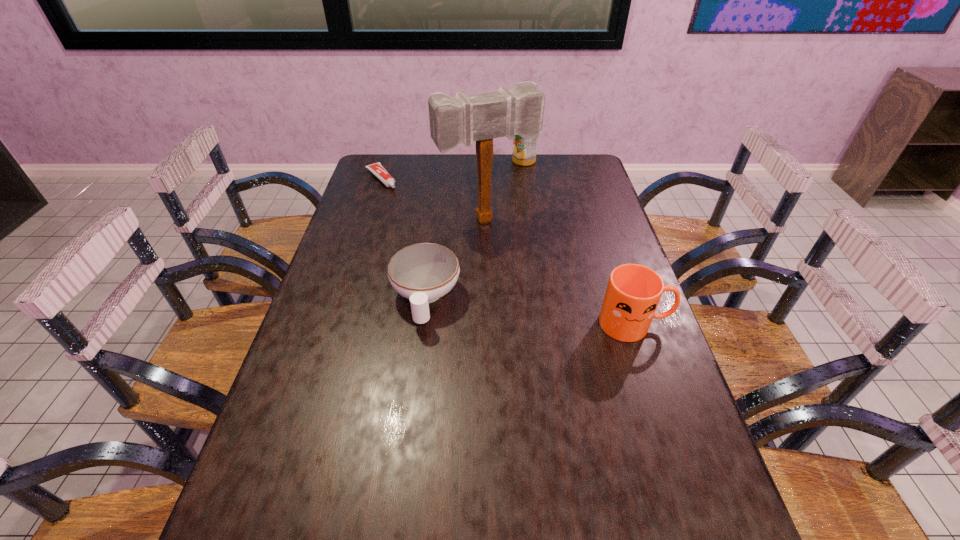
The height and width of the screenshot is (540, 960). In order to click on vacant spot on the desktop that is between the fourth tallest object and the rightmost object and is positioned on the front label of the fruit juice in this screenshot , I will do `click(556, 314)`.

Find the location of a particular element. Image resolution: width=960 pixels, height=540 pixels. free spot on the desktop that is between the chinaware and the third shortest object and is positioned at the head of the tallest object is located at coordinates (541, 313).

Image resolution: width=960 pixels, height=540 pixels. I want to click on vacant spot on the desktop that is between the second shortest object and the rightmost object and is positioned at the nozzle of the leftmost object, so click(504, 308).